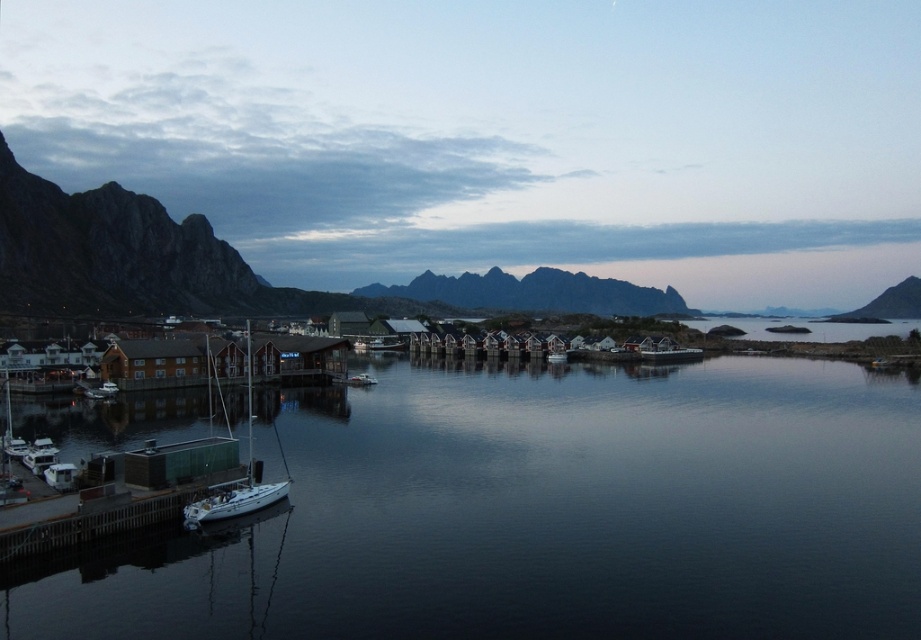
Who is shorter, dark reflective water at center or rugged stone mountains at center?

dark reflective water at center

Locate an element on the screen. The image size is (921, 640). dark reflective water at center is located at coordinates (546, 513).

Can you confirm if rugged stone mountains at center is taller than rugged stone mountain at right?

Correct, rugged stone mountains at center is much taller as rugged stone mountain at right.

Is point (620, 305) closer to camera compared to point (918, 278)?

That is False.

At what (x,y) coordinates should I click in order to perform the action: click on rugged stone mountains at center. Please return your answer as a coordinate pair (x, y). Looking at the image, I should click on (535, 292).

Does dark reflective water at center come in front of white matte sailboat at lower left?

That is True.

Does dark reflective water at center have a lesser width compared to white matte sailboat at lower left?

No.

This screenshot has width=921, height=640. I want to click on dark reflective water at center, so click(546, 513).